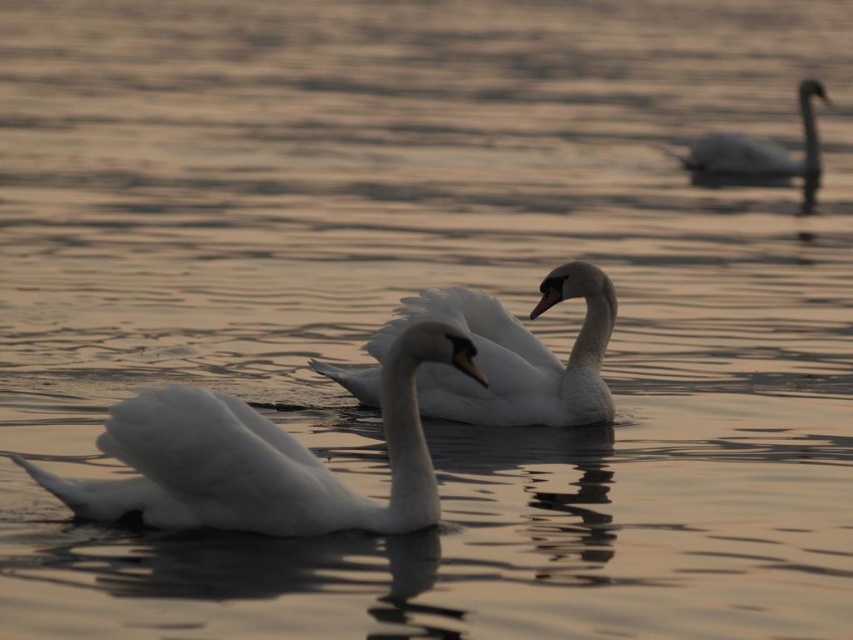
You are a wildlife photographer aiming to capture the largest swan in the image. You see the white feathered swan at center and the white glossy swan at center. Which one should you focus on to get the largest swan?

The white glossy swan at center is larger than the white feathered swan at center, so you should focus on the white glossy swan at center to capture the largest swan.

You are a photographer aiming to capture the swans in the image. You want to ensure both the white glossy swan at center and the white glossy swan at upper right are fully visible in your shot. Given that your camera has a fixed focal length, which swan requires you to adjust your camera angle less to keep it in frame?

The white glossy swan at upper right requires less adjustment because it is narrower than the white glossy swan at center, which is wider. Since the camera has a fixed focal length, capturing a narrower object needs less angle adjustment compared to a wider one.

You are a photographer trying to capture the swan at point (260, 458). Based on the scene description, where should you aim your camera to ensure the swan is in the center of your shot?

The white feathered swan at center is already located at point (260, 458), so aiming your camera at that coordinate will center the swan in your shot.